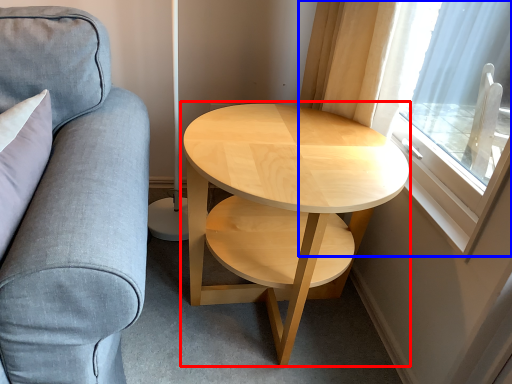
Question: Which object appears closest to the camera in this image, coffee table (highlighted by a red box) or window (highlighted by a blue box)?

Choices:
 (A) coffee table
 (B) window

Answer: (B)